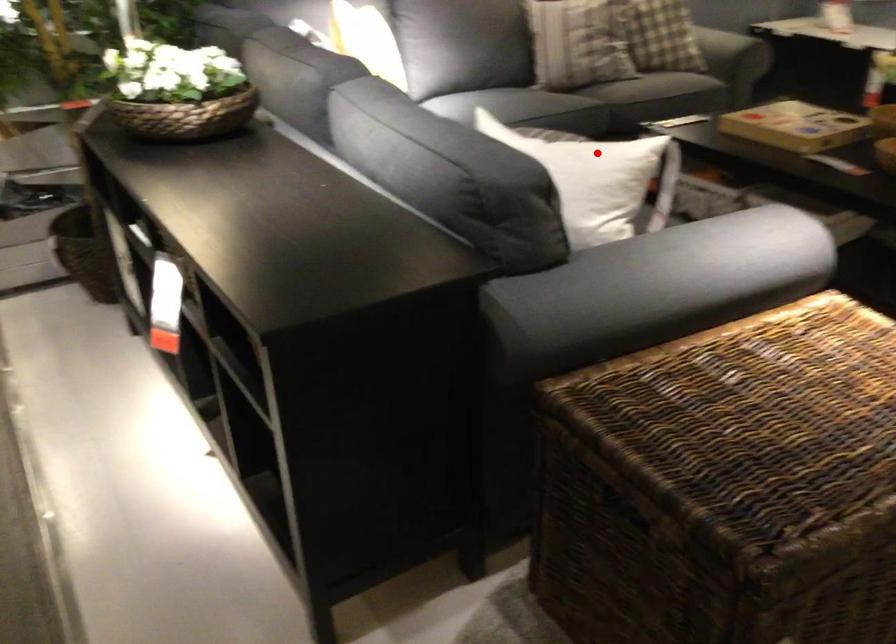
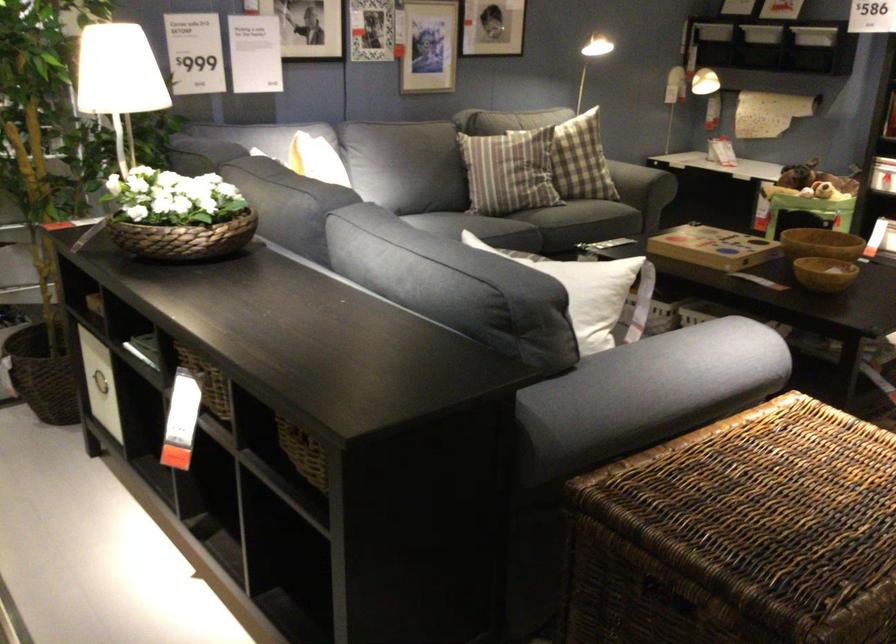
Where in the second image is the point corresponding to the highlighted location from the first image?

(581, 272)